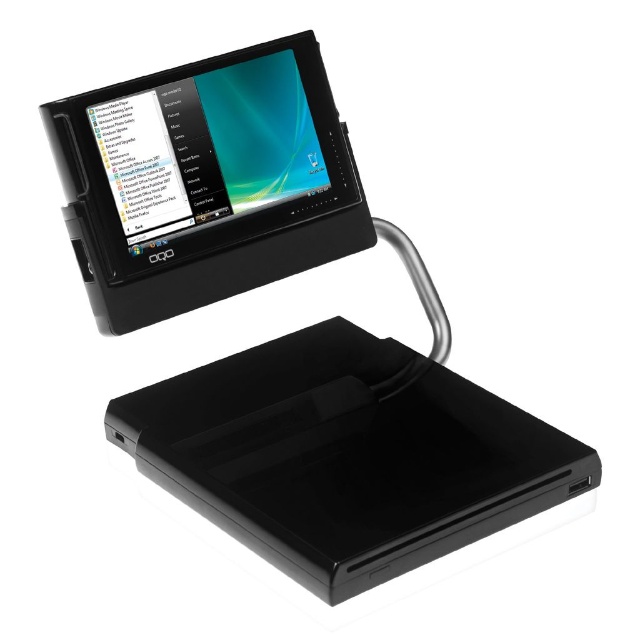
You are setting up a docking station for your devices. You have a black glossy ipod at lower center and a matte black tablet at upper left. Which device should you place in the larger docking port if the port is designed to accommodate bigger devices?

The black glossy ipod at lower center is bigger than the matte black tablet at upper left, so you should place the black glossy ipod at lower center in the larger docking port.

You are setting up a docking station and need to connect the black glossy ipod at lower center and the matte black tablet at upper left. According to their positions, which device is located to the right of the other?

The black glossy ipod at lower center is positioned on the right side of matte black tablet at upper left, so the black glossy ipod at lower center is to the right of the matte black tablet at upper left.

You are setting up a docking station for your devices. You have a black glossy ipod at lower center and a matte black tablet at upper left. Can you place them side by side without overlapping?

The black glossy ipod at lower center and matte black tablet at upper left are 6.39 inches apart, so yes, they can be placed side by side without overlapping as there is sufficient space between them.